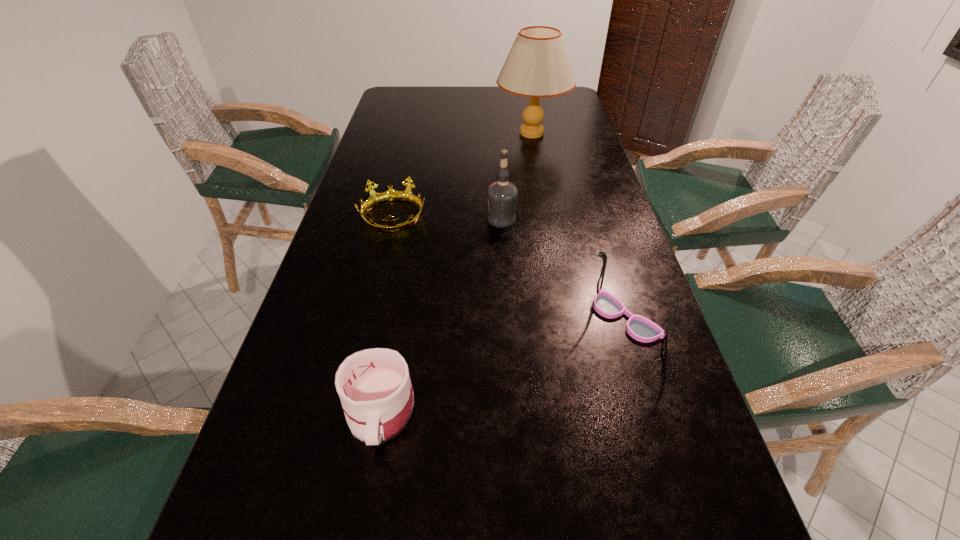
In the image, there is a desktop. Where is `free space at the left edge`? free space at the left edge is located at coordinates [x=337, y=330].

Locate an element on the screen. The image size is (960, 540). free spot at the right edge of the desktop is located at coordinates click(614, 212).

Locate an element on the screen. The width and height of the screenshot is (960, 540). vacant space at the far left corner of the desktop is located at coordinates (387, 102).

Find the location of `free space between the fourth shortest object and the lampshade`. free space between the fourth shortest object and the lampshade is located at coordinates (516, 176).

Where is `vacant space that's between the shortest object and the vodka`? vacant space that's between the shortest object and the vodka is located at coordinates [x=447, y=218].

The image size is (960, 540). Find the location of `free space between the fourth farthest object and the nearest object`. free space between the fourth farthest object and the nearest object is located at coordinates coord(502,364).

The image size is (960, 540). Find the location of `unoccupied position between the second nearest object and the fourth tallest object`. unoccupied position between the second nearest object and the fourth tallest object is located at coordinates (502, 364).

This screenshot has height=540, width=960. In order to click on vacant area that lies between the crown and the second shortest object in this screenshot , I will do `click(387, 314)`.

Locate an element on the screen. free spot between the tallest object and the fourth farthest object is located at coordinates (579, 225).

Locate an element on the screen. unoccupied position between the farthest object and the shortest object is located at coordinates [463, 175].